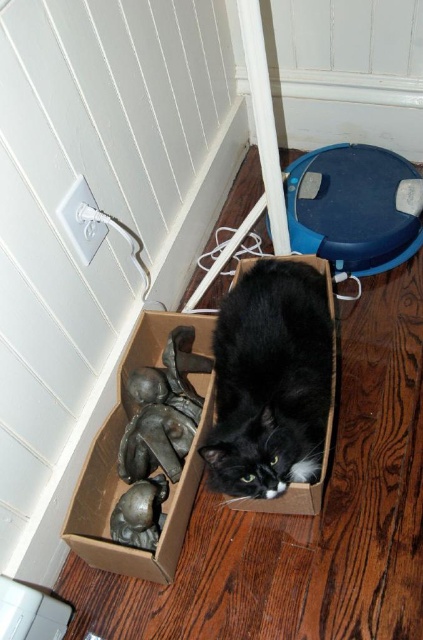
You are trying to place a small toy mouse inside the cardboard box where the black cat is resting. The toy mouse must be placed in an area that is not directly under the cat to avoid startling it. Given the cat is represented by the point at coordinates point (x=271, y=380), where should you place the toy mouse?

The black soft fur cat at center is represented by point (x=271, y=380). To avoid startling the cat, place the toy mouse away from this central point, perhaps near the edges or corners of the cardboard box where the cat is not directly lying.

From the picture: You are a delivery person who just delivered a package to a house. You see a black soft fur cat at center and a brown cardboard box at lower center. The cat is curious about the box. Can the cat easily reach the box without moving more than 15 centimeters from its current position?

The black soft fur cat at center and brown cardboard box at lower center are 16.12 centimeters apart, so the cat cannot easily reach the box without moving more than 15 centimeters from its current position.

You are a delivery person who just arrived at a house to drop off a small package. You see the black soft fur cat at center and the brown cardboard box at lower center. Can you tell if the cat can fit inside the box?

The black soft fur cat at center is not as tall as the brown cardboard box at lower center, so the cat can fit inside the box since it is shorter in height than the box.